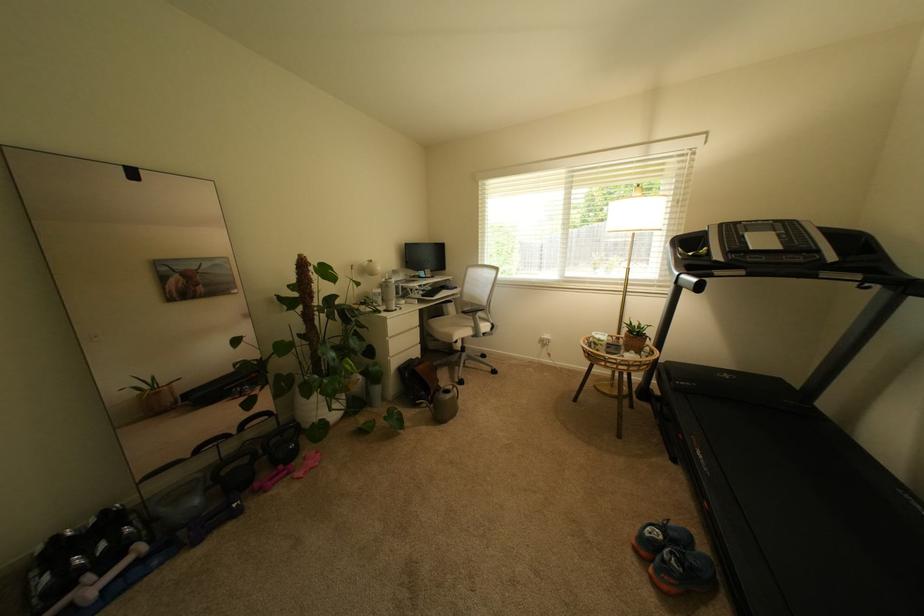
This screenshot has width=924, height=616. Describe the element at coordinates (637, 213) in the screenshot. I see `the desk lamp head` at that location.